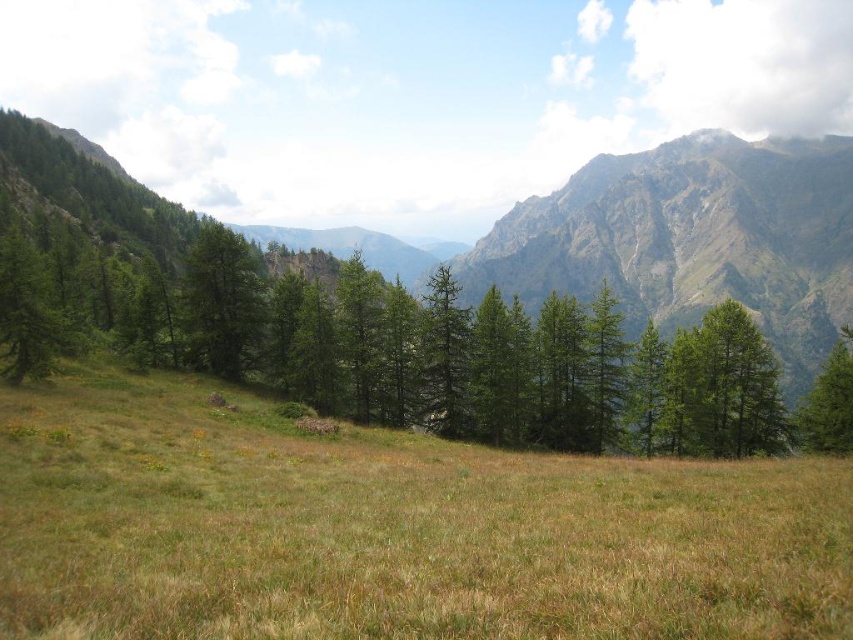
Question: Which object is closer to the camera taking this photo?

Choices:
 (A) green matte tree at right
 (B) green matte tree at upper left

Answer: (A)

Question: Can you confirm if green matte tree at upper left is bigger than green matte tree at right?

Choices:
 (A) no
 (B) yes

Answer: (B)

Question: Can you confirm if green matte tree at upper left is bigger than green matte tree at right?

Choices:
 (A) no
 (B) yes

Answer: (B)

Question: Which point is farther to the camera?

Choices:
 (A) (253, 289)
 (B) (834, 384)

Answer: (A)

Question: Is green matte tree at upper left thinner than green matte tree at right?

Choices:
 (A) yes
 (B) no

Answer: (A)